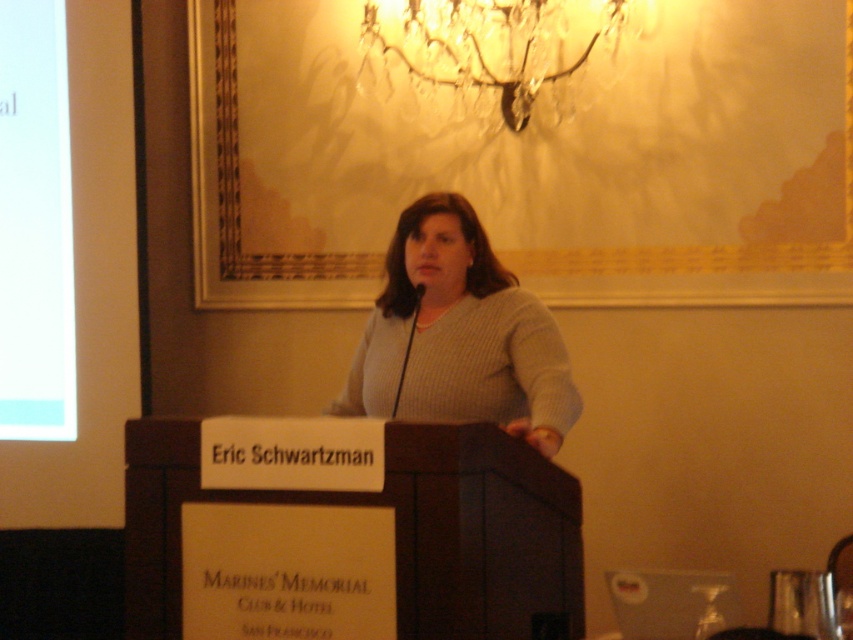
You are an interior designer assessing the layout of the event space. The gray knitted sweater at center and the crystal glass chandelier at upper center are both in your line of sight. Which object is narrower in width?

The gray knitted sweater at center has a lesser width compared to the crystal glass chandelier at upper center, so the gray knitted sweater at center is narrower in width.

You are an event photographer at the Marines Memorial Club and Hotel. You need to capture a closeup of the gray knitted sweater at center. Where should you focus your camera to ensure the sweater is in the frame?

Focus your camera at point (459,336) to capture the gray knitted sweater at center in the frame.